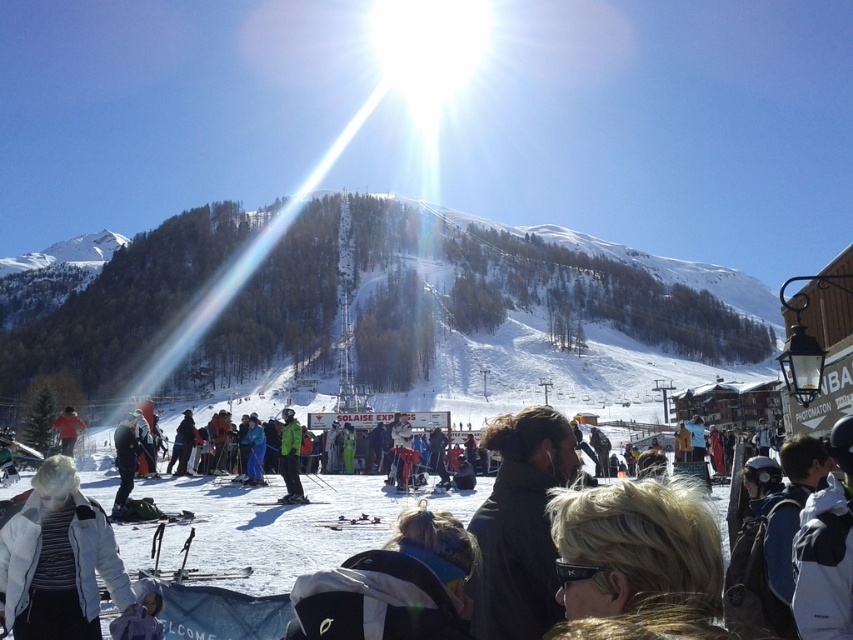
Question: Which point is farther to the camera?

Choices:
 (A) black matte ski at lower center
 (B) white snowboarders at center
 (C) black matte ski at center
 (D) white fleece jacket at lower left

Answer: (C)

Question: Is white fleece jacket at lower left above black matte ski at center?

Choices:
 (A) yes
 (B) no

Answer: (A)

Question: Considering the relative positions of green matte jacket at center and black matte ski at lower center in the image provided, where is green matte jacket at center located with respect to black matte ski at lower center?

Choices:
 (A) left
 (B) right

Answer: (A)

Question: Does green matte jacket at center have a greater width compared to matte black skis at center?

Choices:
 (A) yes
 (B) no

Answer: (A)

Question: Which object is closer to the camera taking this photo?

Choices:
 (A) black matte ski at center
 (B) white snowboarders at center
 (C) matte black skis at center
 (D) white fleece jacket at lower left

Answer: (B)

Question: Among these points, which one is nearest to the camera?

Choices:
 (A) (288, 432)
 (B) (44, 570)
 (C) (310, 502)

Answer: (B)